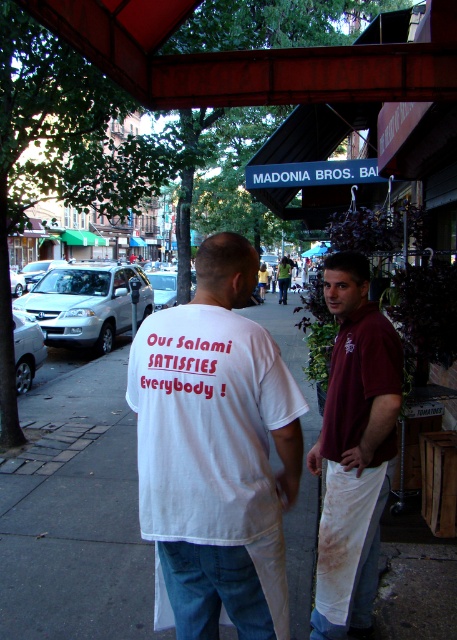
Question: From the image, what is the correct spatial relationship of white cotton t-shirt at center in relation to maroon shirt at center?

Choices:
 (A) above
 (B) below

Answer: (A)

Question: Is white cotton t-shirt at center wider than maroon shirt at center?

Choices:
 (A) no
 (B) yes

Answer: (B)

Question: Which point is closer to the camera?

Choices:
 (A) maroon shirt at center
 (B) white cotton t-shirt at center

Answer: (B)

Question: Is white cotton t-shirt at center bigger than maroon shirt at center?

Choices:
 (A) no
 (B) yes

Answer: (B)

Question: Which object appears farthest from the camera in this image?

Choices:
 (A) maroon shirt at center
 (B) white cotton t-shirt at center

Answer: (A)

Question: Among these objects, which one is nearest to the camera?

Choices:
 (A) maroon shirt at center
 (B) white cotton t-shirt at center

Answer: (B)